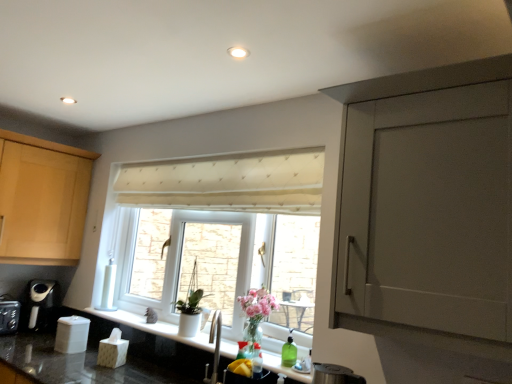
Question: Is cream quilted curtain at center directly adjacent to clear glass vase at lower center?

Choices:
 (A) yes
 (B) no

Answer: (B)

Question: Can you confirm if cream quilted curtain at center is smaller than clear glass vase at lower center?

Choices:
 (A) yes
 (B) no

Answer: (B)

Question: Is cream quilted curtain at center at the left side of clear glass vase at lower center?

Choices:
 (A) no
 (B) yes

Answer: (B)

Question: Does cream quilted curtain at center lie behind clear glass vase at lower center?

Choices:
 (A) no
 (B) yes

Answer: (A)

Question: Would you say cream quilted curtain at center contains clear glass vase at lower center?

Choices:
 (A) no
 (B) yes

Answer: (A)

Question: Do you think black plastic coffee machine at lower left is within white matte pot at window, or outside of it?

Choices:
 (A) outside
 (B) inside

Answer: (A)

Question: From the image's perspective, is black plastic coffee machine at lower left located above or below white matte pot at window?

Choices:
 (A) below
 (B) above

Answer: (A)

Question: In the image, is black plastic coffee machine at lower left on the left side or the right side of white matte pot at window?

Choices:
 (A) right
 (B) left

Answer: (B)

Question: Is point (42, 322) closer or farther from the camera than point (181, 309)?

Choices:
 (A) farther
 (B) closer

Answer: (A)

Question: Is clear glass vase at lower center taller or shorter than white matte pot at window?

Choices:
 (A) short
 (B) tall

Answer: (A)

Question: Considering the positions of clear glass vase at lower center and white matte pot at window in the image, is clear glass vase at lower center bigger or smaller than white matte pot at window?

Choices:
 (A) small
 (B) big

Answer: (B)

Question: From a real-world perspective, is clear glass vase at lower center physically located above or below white matte pot at window?

Choices:
 (A) below
 (B) above

Answer: (A)

Question: Considering the positions of clear glass vase at lower center and white matte pot at window in the image, is clear glass vase at lower center wider or thinner than white matte pot at window?

Choices:
 (A) thin
 (B) wide

Answer: (B)

Question: Is cream quilted curtain at center in front of or behind white matte pot at window in the image?

Choices:
 (A) front
 (B) behind

Answer: (A)

Question: From the image's perspective, is cream quilted curtain at center above or below white matte pot at window?

Choices:
 (A) above
 (B) below

Answer: (A)